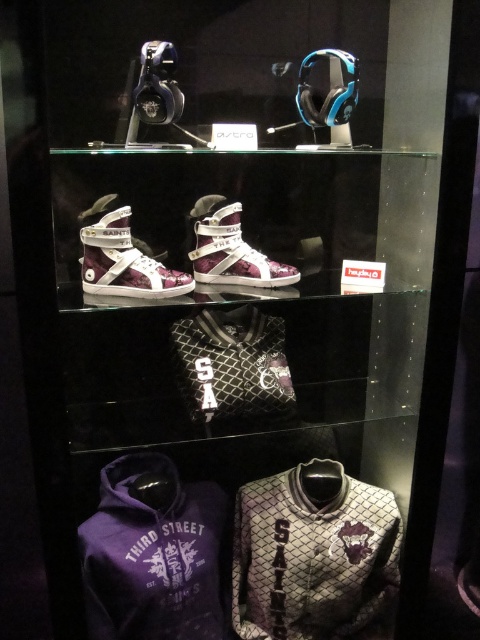
Can you confirm if matte purple fabric sneaker at center is positioned to the right of white leather high-top sneaker at center?

No, matte purple fabric sneaker at center is not to the right of white leather high-top sneaker at center.

Can you confirm if matte purple fabric sneaker at center is thinner than white leather high-top sneaker at center?

Yes.

Describe the element at coordinates (124, 262) in the screenshot. I see `matte purple fabric sneaker at center` at that location.

Find the location of a particular element. matte purple fabric sneaker at center is located at coordinates (124, 262).

Measure the distance from gray textured sweatshirt at center to purple fleece sweatshirt at lower left.

gray textured sweatshirt at center is 7.43 inches from purple fleece sweatshirt at lower left.

Image resolution: width=480 pixels, height=640 pixels. What do you see at coordinates (312, 554) in the screenshot?
I see `gray textured sweatshirt at center` at bounding box center [312, 554].

Between point (357, 518) and point (135, 458), which one is positioned in front?

Point (135, 458) is in front.

You are a GUI agent. You are given a task and a screenshot of the screen. Output one action in this format:
    pyautogui.click(x=<x>, y=<y>)
    Task: Click on the gray textured sweatshirt at center
    The image size is (480, 640).
    Given the screenshot: What is the action you would take?
    pyautogui.click(x=312, y=554)

Is purple fleece sweatshirt at lower left to the right of matte purple fabric sneaker at center from the viewer's perspective?

Yes, purple fleece sweatshirt at lower left is to the right of matte purple fabric sneaker at center.

I want to click on purple fleece sweatshirt at lower left, so click(153, 554).